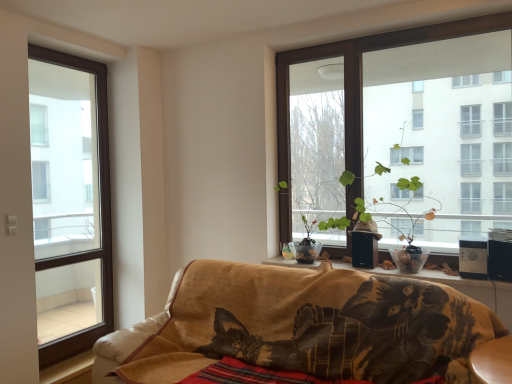
At what (x,y) coordinates should I click in order to perform the action: click on vacant area on top of brown wooden window at upper right, placed as the 2th window when sorted from left to right (from a real-world perspective). Please return your answer as a coordinate pair (x, y). The width and height of the screenshot is (512, 384). Looking at the image, I should click on (392, 24).